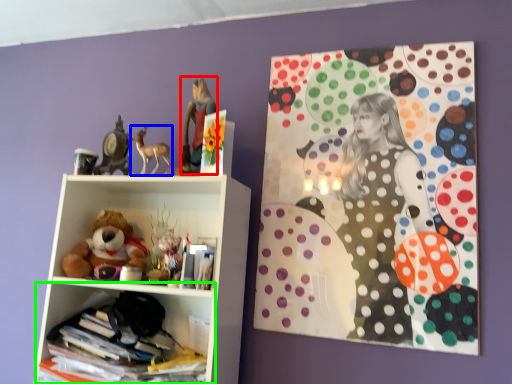
Question: Considering the real-world distances, which object is closest to girl (highlighted by a red box)? animal (highlighted by a blue box) or shelf (highlighted by a green box).

Choices:
 (A) animal
 (B) shelf

Answer: (A)